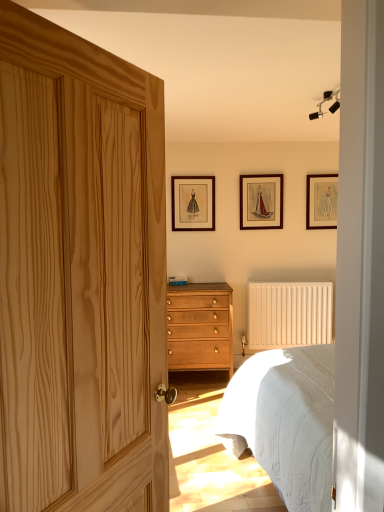
Question: Relative to beige textured radiator at lower right, is black matte track lights at upper right in front or behind?

Choices:
 (A) front
 (B) behind

Answer: (A)

Question: From the image's perspective, is black matte track lights at upper right located above or below beige textured radiator at lower right?

Choices:
 (A) above
 (B) below

Answer: (A)

Question: Estimate the real-world distances between objects in this image. Which object is farther from the black matte track lights at upper right?

Choices:
 (A) natural wood door at left
 (B) wooden picture frame at upper right, placed as the 3th picture frame when sorted from left to right
 (C) wooden picture frame at upper center, the first picture frame in the left-to-right sequence
 (D) light brown wood chest of drawers at center
 (E) beige textured radiator at lower right

Answer: (D)

Question: Which object is the farthest from the white textured bed at lower right?

Choices:
 (A) beige textured radiator at lower right
 (B) black matte track lights at upper right
 (C) light brown wood chest of drawers at center
 (D) natural wood door at left
 (E) wooden picture frame at upper center, the first picture frame in the left-to-right sequence

Answer: (E)